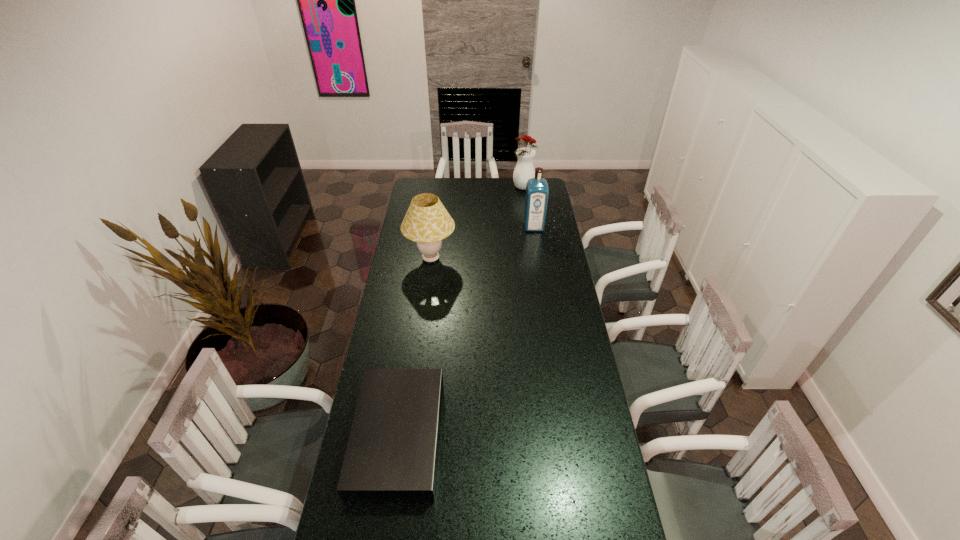
The image size is (960, 540). I want to click on the farthest object, so click(524, 170).

Find the location of a particular element. This screenshot has height=540, width=960. liquor is located at coordinates (537, 191).

Where is `lampshade`? The height and width of the screenshot is (540, 960). lampshade is located at coordinates (427, 222).

Locate an element on the screen. CD player is located at coordinates (392, 452).

I want to click on the nearest object, so click(x=392, y=452).

This screenshot has height=540, width=960. I want to click on blank space located on the left of the farthest object, so click(459, 188).

Image resolution: width=960 pixels, height=540 pixels. What are the coordinates of `free region located on the flat label side of the second farthest object` in the screenshot? It's located at (541, 278).

Where is `vacant space located 0.090m on the back of the third farthest object`? vacant space located 0.090m on the back of the third farthest object is located at coordinates (434, 233).

The width and height of the screenshot is (960, 540). I want to click on free space located at the front of the shortest object for disc insertion, so coord(521,437).

Where is `object that is at the far edge`? The image size is (960, 540). object that is at the far edge is located at coordinates (524, 170).